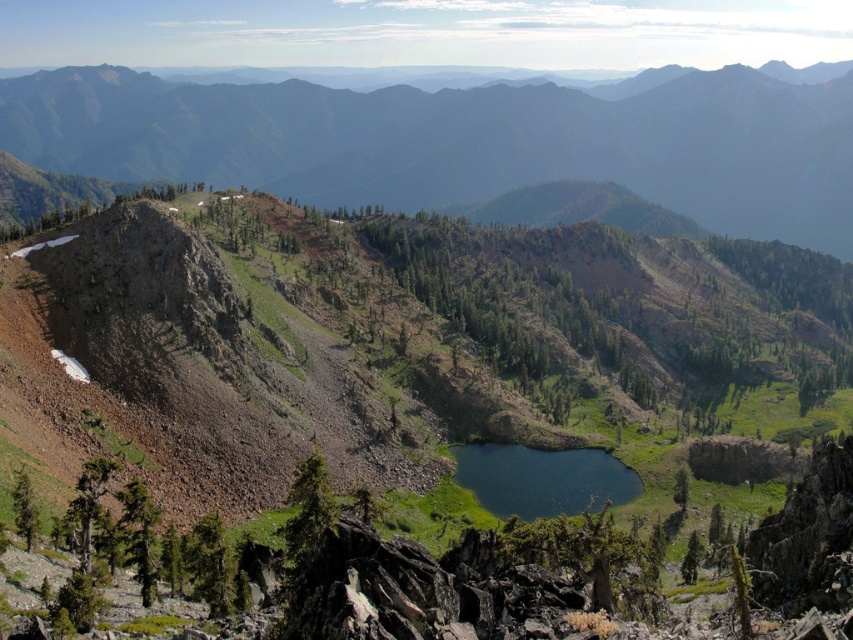
At what (x,y) coordinates should I click in order to perform the action: click on green grassy mountain at upper center. Please return your answer as a coordinate pair (x, y). The image size is (853, 640). Looking at the image, I should click on (463, 141).

Between green grassy mountain at upper center and deep blue water at center, which one appears on the left side from the viewer's perspective?

From the viewer's perspective, green grassy mountain at upper center appears more on the left side.

What do you see at coordinates (463, 141) in the screenshot? I see `green grassy mountain at upper center` at bounding box center [463, 141].

Where is `green grassy mountain at upper center`? The image size is (853, 640). green grassy mountain at upper center is located at coordinates (463, 141).